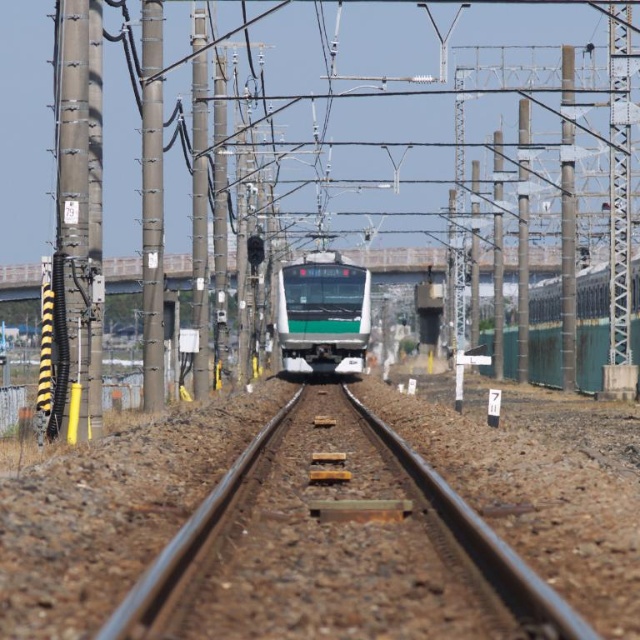
Is the position of smooth metal train track at center more distant than that of green matte train at center?

No, smooth metal train track at center is in front of green matte train at center.

Between smooth metal train track at center and green matte train at center, which one appears on the left side from the viewer's perspective?

green matte train at center is more to the left.

This screenshot has width=640, height=640. I want to click on smooth metal train track at center, so click(337, 547).